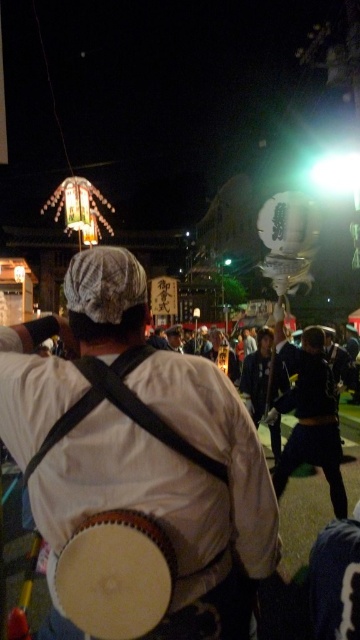
You are at the festival and want to locate the person wearing dark blue fabric pants at lower right. Which direction should you look relative to the white drum at center?

The dark blue fabric pants at lower right are to the right of the white drum at center, so you should look to the right side of the white drum at center to find them.

You are a festival attendee standing at the center of the scene. You want to locate the white fabric drum at center. According to the coordinates provided, in which direction should you look relative to your current position?

The white fabric drum at center is located at coordinates point (x=173, y=490). Since you are at the center, you should look towards the lower right direction to find it.